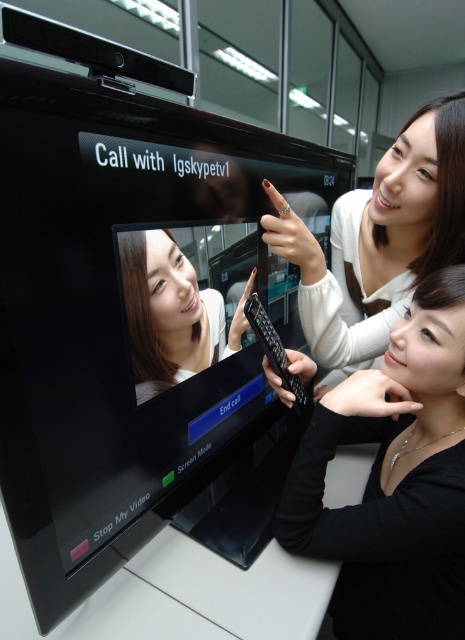
Does smooth skin face at center appear on the right side of black plastic remote at lower right?

Incorrect, smooth skin face at center is not on the right side of black plastic remote at lower right.

The height and width of the screenshot is (640, 465). What do you see at coordinates (172, 314) in the screenshot?
I see `smooth skin face at center` at bounding box center [172, 314].

What do you see at coordinates (172, 314) in the screenshot? This screenshot has width=465, height=640. I see `smooth skin face at center` at bounding box center [172, 314].

Image resolution: width=465 pixels, height=640 pixels. Find the location of `smooth skin face at center`. smooth skin face at center is located at coordinates (172, 314).

Looking at this image, is the position of black matte remote control at center less distant than that of black plastic remote at lower right?

Yes, it is.

Describe the element at coordinates (393, 480) in the screenshot. I see `black matte remote control at center` at that location.

Does point (449, 458) lie behind point (284, 348)?

No, it is not.

Find the location of a particular element. This screenshot has height=640, width=465. black matte remote control at center is located at coordinates [393, 480].

In the scene shown: Does black matte remote control at center lie in front of smooth skin face at center?

That is False.

Does black matte remote control at center have a lesser width compared to smooth skin face at center?

In fact, black matte remote control at center might be wider than smooth skin face at center.

At what (x,y) coordinates should I click in order to perform the action: click on black matte remote control at center. Please return your answer as a coordinate pair (x, y). Image resolution: width=465 pixels, height=640 pixels. Looking at the image, I should click on [x=393, y=480].